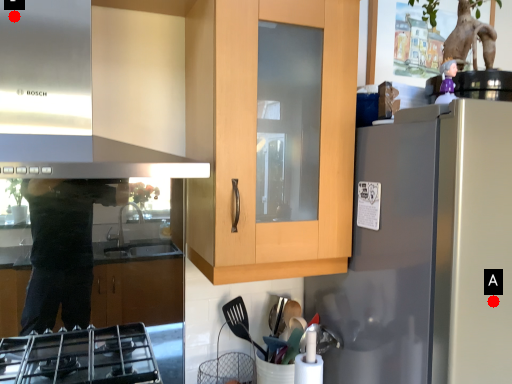
Question: Two points are circled on the image, labeled by A and B beside each circle. Which point appears closest to the camera in this image?

Choices:
 (A) A is closer
 (B) B is closer

Answer: (A)